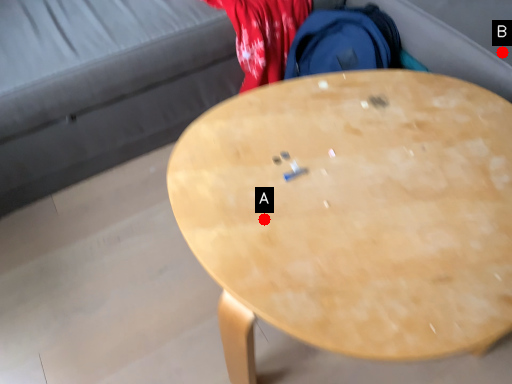
Question: Two points are circled on the image, labeled by A and B beside each circle. Among these points, which one is farthest from the camera?

Choices:
 (A) A is further
 (B) B is further

Answer: (B)